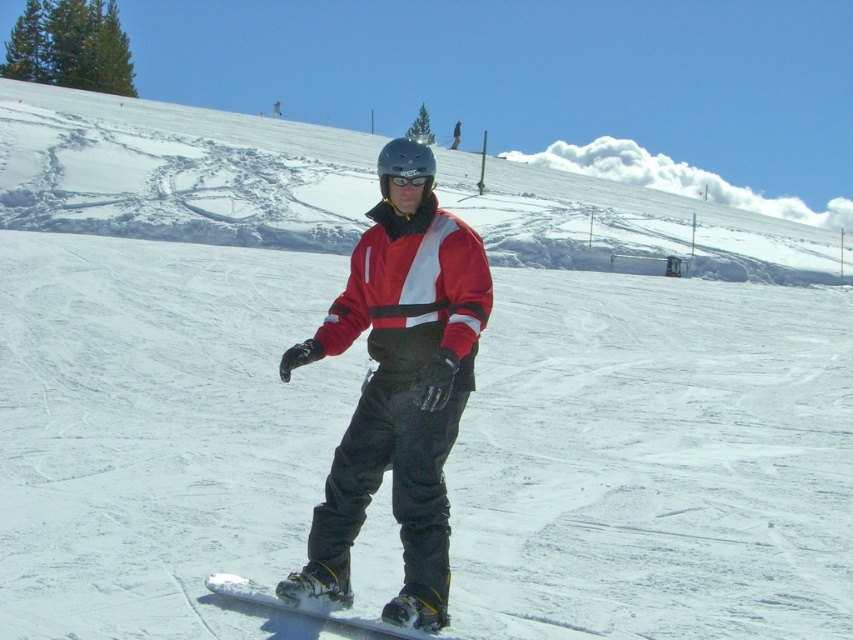
Who is more forward, (416, 586) or (427, 182)?

Point (427, 182)

Is matte red snowboarder at center wider than transparent plastic goggles at center?

Yes.

Is point (323, 568) farther from camera compared to point (427, 184)?

That is True.

Image resolution: width=853 pixels, height=640 pixels. In order to click on matte red snowboarder at center in this screenshot , I will do `click(398, 387)`.

Is matte red snowboarder at center to the left of white matte snowboard at center from the viewer's perspective?

Incorrect, matte red snowboarder at center is not on the left side of white matte snowboard at center.

Does point (434, 500) lie behind point (440, 636)?

Yes.

Locate an element on the screen. Image resolution: width=853 pixels, height=640 pixels. matte red snowboarder at center is located at coordinates (398, 387).

Does white matte snowboard at center have a larger size compared to transparent plastic goggles at center?

Yes, white matte snowboard at center is bigger than transparent plastic goggles at center.

Does white matte snowboard at center lie in front of transparent plastic goggles at center?

Yes, white matte snowboard at center is in front of transparent plastic goggles at center.

Measure the distance between white matte snowboard at center and camera.

white matte snowboard at center and camera are 4.85 meters apart from each other.

Locate an element on the screen. white matte snowboard at center is located at coordinates (311, 605).